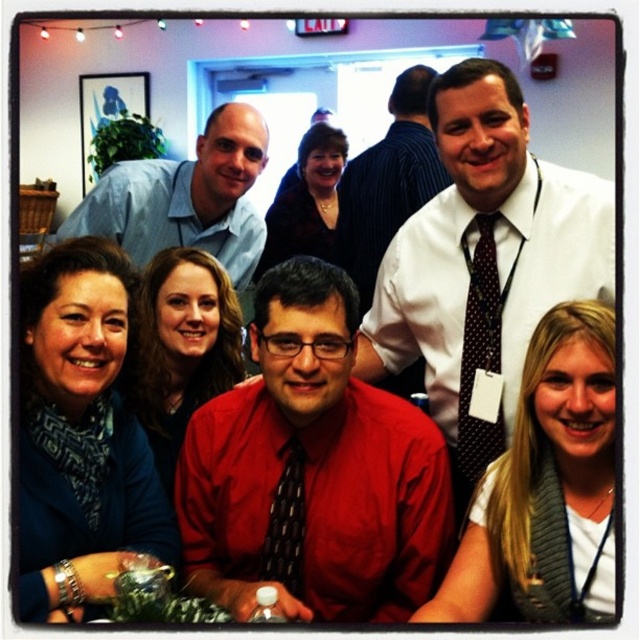
Is point (221, 148) in front of point (428, 81)?

Yes, point (221, 148) is in front of point (428, 81).

Who is more distant from viewer, (154, 225) or (369, 236)?

Positioned behind is point (369, 236).

Who is more forward, [200,154] or [360,276]?

Positioned in front is point [200,154].

Locate an element on the screen. The width and height of the screenshot is (640, 640). matte blue shirt at upper left is located at coordinates (186, 196).

Can you confirm if red satin shirt at center is shorter than matte black sweater at center?

Indeed, red satin shirt at center has a lesser height compared to matte black sweater at center.

Between red satin shirt at center and matte black sweater at center, which one is positioned higher?

matte black sweater at center is above.

Which is behind, point (371, 618) or point (310, 198)?

Point (310, 198)

I want to click on red satin shirt at center, so click(x=312, y=470).

Where is `matte black hair at center`? Image resolution: width=640 pixels, height=640 pixels. matte black hair at center is located at coordinates [180, 348].

Can you confirm if matte black hair at center is shorter than matte black sweater at center?

Indeed, matte black hair at center has a lesser height compared to matte black sweater at center.

This screenshot has width=640, height=640. I want to click on matte black hair at center, so click(x=180, y=348).